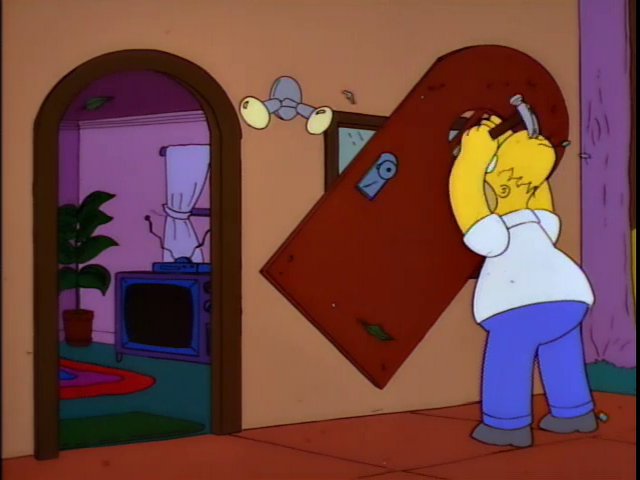
The height and width of the screenshot is (480, 640). What are the coordinates of `door` in the screenshot? It's located at (406, 192).